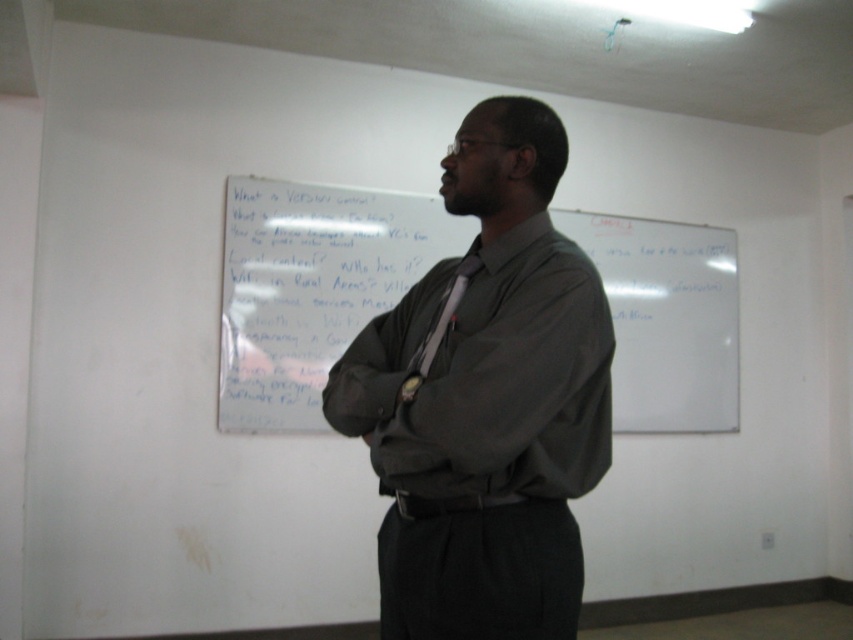
Does whiteboard at center have a greater height compared to dark gray shirt at center?

Indeed, whiteboard at center has a greater height compared to dark gray shirt at center.

Between whiteboard at center and dark gray shirt at center, which one is positioned lower?

dark gray shirt at center is below.

Which is in front, point (287, 282) or point (505, 449)?

Point (505, 449) is in front.

This screenshot has height=640, width=853. What are the coordinates of `whiteboard at center` in the screenshot? It's located at (311, 288).

Does matte gray shirt at center have a lesser width compared to dark gray shirt at center?

In fact, matte gray shirt at center might be wider than dark gray shirt at center.

Looking at this image, can you confirm if matte gray shirt at center is shorter than dark gray shirt at center?

In fact, matte gray shirt at center may be taller than dark gray shirt at center.

Is point (419, 401) positioned in front of point (456, 448)?

That is False.

Identify the location of matte gray shirt at center. This screenshot has width=853, height=640. (486, 401).

Looking at this image, does dark gray shirt at center have a greater width compared to matte black tie at center?

Yes, dark gray shirt at center is wider than matte black tie at center.

Between dark gray shirt at center and matte black tie at center, which one has more height?

dark gray shirt at center is taller.

Who is more forward, (548, 323) or (436, 342)?

Point (548, 323)

Where is `dark gray shirt at center`? The image size is (853, 640). dark gray shirt at center is located at coordinates (495, 384).